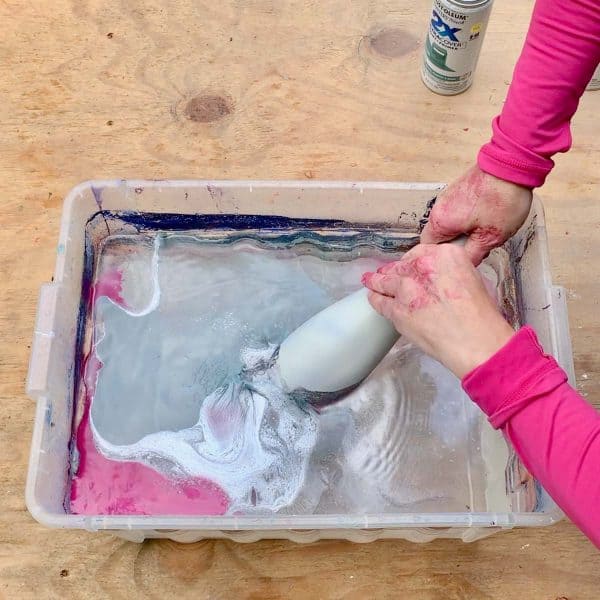
Identify the location of grey paint. (332, 402).